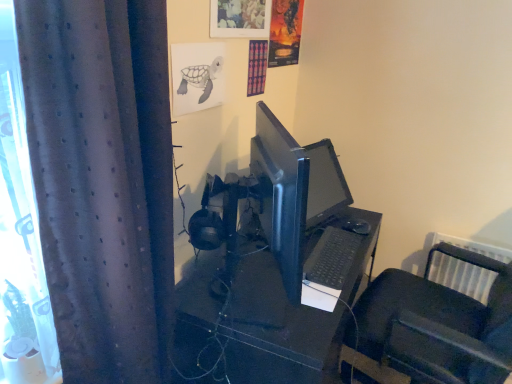
Where is `black matte keyboard at center`? The image size is (512, 384). black matte keyboard at center is located at coordinates (332, 257).

Locate an element on the screen. The height and width of the screenshot is (384, 512). black plastic chair at lower right is located at coordinates (436, 325).

Measure the distance between dark grey textured curtain at left and camera.

A distance of 79.90 centimeters exists between dark grey textured curtain at left and camera.

Identify the location of black matte keyboard at center. coord(332,257).

Is black plastic chair at lower right smaller than black plastic desk at center?

Yes, black plastic chair at lower right is smaller than black plastic desk at center.

Is black plastic chair at lower right oriented away from black plastic desk at center?

black plastic chair at lower right does not have its back to black plastic desk at center.

Considering the relative sizes of black plastic chair at lower right and black plastic desk at center in the image provided, is black plastic chair at lower right thinner than black plastic desk at center?

Yes, black plastic chair at lower right is thinner than black plastic desk at center.

From the picture: How different are the orientations of black plastic chair at lower right and black plastic desk at center in degrees?

They differ by 92.6 degrees in their facing directions.

Is black matte keyboard at center not close to dark grey textured curtain at left?

No.

What's the angular difference between black matte keyboard at center and dark grey textured curtain at left's facing directions?

5.71 degrees separate the facing orientations of black matte keyboard at center and dark grey textured curtain at left.

Considering the positions of point (341, 229) and point (92, 350), is point (341, 229) closer or farther from the camera than point (92, 350)?

Point (341, 229) is farther from the camera than point (92, 350).

From the image's perspective, between black matte keyboard at center and dark grey textured curtain at left, which one is located above?

dark grey textured curtain at left appears higher in the image.

Where is `computer keyboard above the black plastic chair at lower right (from the image's perspective)`? computer keyboard above the black plastic chair at lower right (from the image's perspective) is located at coordinates (332, 257).

From the image's perspective, is black matte keyboard at center located above black plastic chair at lower right?

Yes, from the image's perspective, black matte keyboard at center is on top of black plastic chair at lower right.

From their relative heights in the image, would you say black matte keyboard at center is taller or shorter than black plastic chair at lower right?

Considering their sizes, black matte keyboard at center has less height than black plastic chair at lower right.

Considering the relative sizes of black matte keyboard at center and black plastic chair at lower right in the image provided, is black matte keyboard at center bigger than black plastic chair at lower right?

No, black matte keyboard at center is not bigger than black plastic chair at lower right.

Is dark grey textured curtain at left far away from black plastic desk at center?

No, dark grey textured curtain at left is in close proximity to black plastic desk at center.

Considering the relative sizes of dark grey textured curtain at left and black plastic desk at center in the image provided, is dark grey textured curtain at left wider than black plastic desk at center?

Incorrect, the width of dark grey textured curtain at left does not surpass that of black plastic desk at center.

Who is shorter, dark grey textured curtain at left or black plastic desk at center?

Standing shorter between the two is black plastic desk at center.

Would you say dark grey textured curtain at left is inside or outside black plastic desk at center?

dark grey textured curtain at left is not inside black plastic desk at center, it's outside.

Is dark grey textured curtain at left spatially inside black matte keyboard at center, or outside of it?

dark grey textured curtain at left cannot be found inside black matte keyboard at center.

From the image's perspective, which one is positioned lower, dark grey textured curtain at left or black matte keyboard at center?

black matte keyboard at center is shown below in the image.

Looking at this image, who is smaller, dark grey textured curtain at left or black matte keyboard at center?

black matte keyboard at center is smaller.

How many degrees apart are the facing directions of black plastic desk at center and black matte keyboard at center?

There is a 2.77-degree angle between the facing directions of black plastic desk at center and black matte keyboard at center.

Is black plastic desk at center turned away from black matte keyboard at center?

black plastic desk at center is not turned away from black matte keyboard at center.

Looking at this image, which is farther from the camera, (247, 348) or (325, 270)?

Positioned behind is point (325, 270).

From the picture: Is black plastic desk at center positioned beyond the bounds of black matte keyboard at center?

black plastic desk at center is positioned outside black matte keyboard at center.

What are the coordinates of `furniture below the dark grey textured curtain at left (from the image's perspective)` in the screenshot? It's located at click(x=436, y=325).

Who is bigger, black plastic chair at lower right or dark grey textured curtain at left?

Bigger between the two is dark grey textured curtain at left.

Is black plastic chair at lower right facing away from dark grey textured curtain at left?

No.

The height and width of the screenshot is (384, 512). In order to click on furniture above the black plastic desk at center (from the image's perspective) in this screenshot , I will do `click(436, 325)`.

Where is `computer keyboard on the right side of dark grey textured curtain at left`? Image resolution: width=512 pixels, height=384 pixels. computer keyboard on the right side of dark grey textured curtain at left is located at coordinates (332, 257).

From the picture: Which object lies further to the anchor point black matte keyboard at center, dark grey textured curtain at left or black plastic desk at center?

dark grey textured curtain at left.

Considering their positions, is black matte keyboard at center positioned closer to black plastic desk at center than black plastic chair at lower right?

Based on the image, black matte keyboard at center appears to be nearer to black plastic desk at center.

Estimate the real-world distances between objects in this image. Which object is closer to dark grey textured curtain at left, black plastic desk at center or black plastic chair at lower right?

Among the two, black plastic desk at center is located nearer to dark grey textured curtain at left.

Looking at the image, which one is located further to black plastic chair at lower right, dark grey textured curtain at left or black matte keyboard at center?

dark grey textured curtain at left is positioned further to the anchor black plastic chair at lower right.

Based on their spatial positions, is black plastic chair at lower right or dark grey textured curtain at left closer to black matte keyboard at center?

black plastic chair at lower right is closer to black matte keyboard at center.

Based on their spatial positions, is black matte keyboard at center or black plastic chair at lower right further from dark grey textured curtain at left?

black plastic chair at lower right lies further to dark grey textured curtain at left than the other object.

Looking at this image, looking at the image, which one is located further to black plastic chair at lower right, black plastic desk at center or dark grey textured curtain at left?

dark grey textured curtain at left is further to black plastic chair at lower right.

From the image, which object appears to be farther from black plastic desk at center, black matte keyboard at center or dark grey textured curtain at left?

Based on the image, dark grey textured curtain at left appears to be further to black plastic desk at center.

Where is `desk between dark grey textured curtain at left and black matte keyboard at center along the z-axis`? The height and width of the screenshot is (384, 512). desk between dark grey textured curtain at left and black matte keyboard at center along the z-axis is located at coordinates (276, 309).

Where is `computer keyboard located between dark grey textured curtain at left and black plastic chair at lower right in the left-right direction`? The width and height of the screenshot is (512, 384). computer keyboard located between dark grey textured curtain at left and black plastic chair at lower right in the left-right direction is located at coordinates (332, 257).

This screenshot has width=512, height=384. In order to click on computer keyboard between black plastic desk at center and black plastic chair at lower right in this screenshot , I will do `click(332, 257)`.

Locate an element on the screen. This screenshot has height=384, width=512. desk situated between dark grey textured curtain at left and black plastic chair at lower right from left to right is located at coordinates (276, 309).